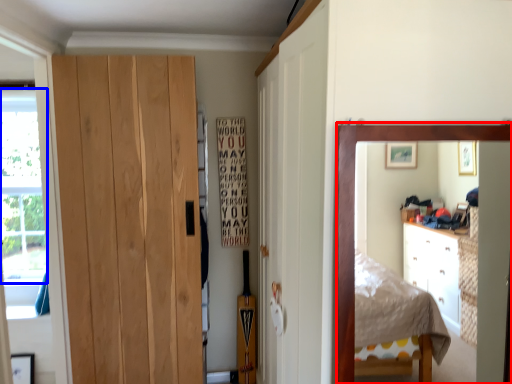
Question: Which object is closer to the camera taking this photo, mirror (highlighted by a red box) or window screen (highlighted by a blue box)?

Choices:
 (A) mirror
 (B) window screen

Answer: (A)